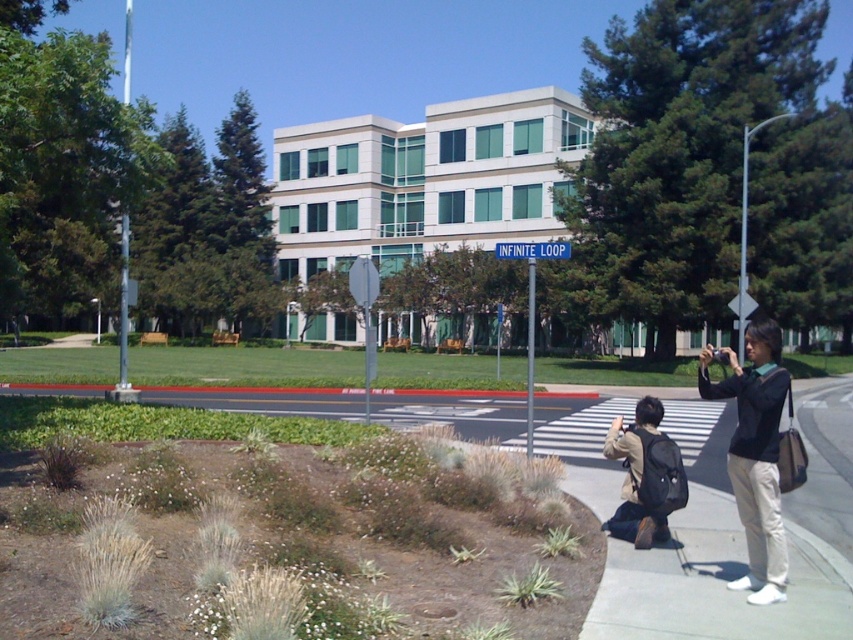
Does gravel textured pavement at lower left lie behind dark blue shirt at right?

No, gravel textured pavement at lower left is closer to the viewer.

This screenshot has width=853, height=640. What do you see at coordinates (727, 554) in the screenshot?
I see `gravel textured pavement at lower left` at bounding box center [727, 554].

The height and width of the screenshot is (640, 853). In order to click on gravel textured pavement at lower left in this screenshot , I will do `click(727, 554)`.

The image size is (853, 640). Find the location of `gravel textured pavement at lower left`. gravel textured pavement at lower left is located at coordinates coord(727,554).

I want to click on gravel textured pavement at lower left, so click(x=727, y=554).

Is khaki cotton jacket at lower right shorter than blue metallic street sign at center?

Yes, khaki cotton jacket at lower right is shorter than blue metallic street sign at center.

Find the location of a particular element. khaki cotton jacket at lower right is located at coordinates (645, 476).